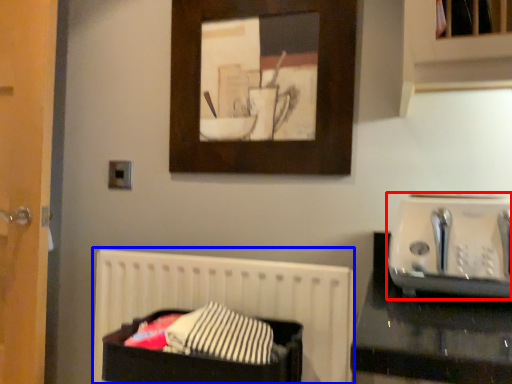
Question: Which object is closer to the camera taking this photo, appliance (highlighted by a red box) or bed (highlighted by a blue box)?

Choices:
 (A) appliance
 (B) bed

Answer: (A)